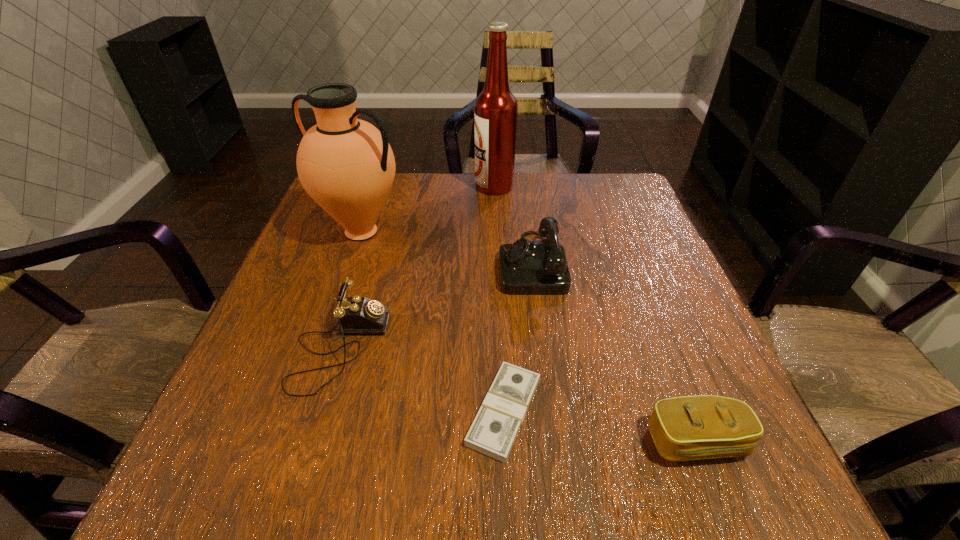
This screenshot has width=960, height=540. In order to click on vacant point located between the third shortest object and the farther telephone in this screenshot , I will do `click(436, 306)`.

You are a GUI agent. You are given a task and a screenshot of the screen. Output one action in this format:
    pyautogui.click(x=<x>, y=<y>)
    Task: Click on the free space between the farthest object and the clutch bag
    Image resolution: width=960 pixels, height=540 pixels.
    Given the screenshot: What is the action you would take?
    pyautogui.click(x=595, y=314)

Where is `the second closest object to the dollar`? The height and width of the screenshot is (540, 960). the second closest object to the dollar is located at coordinates (684, 428).

In order to click on the fifth closest object relative to the left telephone in this screenshot , I will do `click(495, 117)`.

Find the location of a particular element. This screenshot has width=960, height=540. free location that satisfies the following two spatial constraints: 1. on the dial of the third shortest object; 2. on the left side of the shortest object is located at coordinates (321, 411).